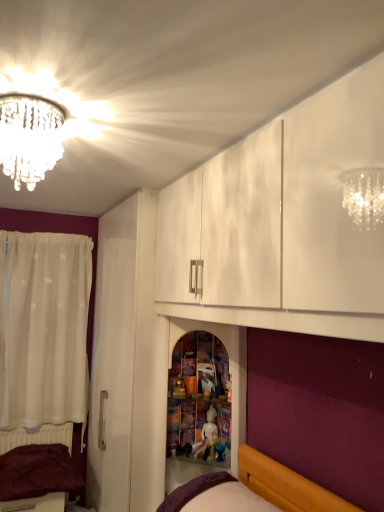
Question: Is white glossy statue at center surrounding purple fabric bed at lower center, which is the 2th bed from bottom to top?

Choices:
 (A) no
 (B) yes

Answer: (A)

Question: From the image's perspective, is white glossy statue at center located beneath purple fabric bed at lower center, which appears as the 1th bed when viewed from the right?

Choices:
 (A) yes
 (B) no

Answer: (B)

Question: Does white glossy statue at center have a lesser height compared to purple fabric bed at lower center, which ranks as the 2th bed in back-to-front order?

Choices:
 (A) no
 (B) yes

Answer: (A)

Question: Can you confirm if white glossy statue at center is positioned to the right of purple fabric bed at lower center, which is the 2th bed from bottom to top?

Choices:
 (A) yes
 (B) no

Answer: (B)

Question: From a real-world perspective, is white glossy statue at center below purple fabric bed at lower center, the 2th bed viewed from the left?

Choices:
 (A) yes
 (B) no

Answer: (B)

Question: Can you confirm if white glossy statue at center is taller than purple fabric bed at lower center, which ranks as the first bed in top-to-bottom order?

Choices:
 (A) no
 (B) yes

Answer: (B)

Question: Is white glossy statue at center next to purple fabric bed at lower left, positioned as the first bed in back-to-front order?

Choices:
 (A) yes
 (B) no

Answer: (B)

Question: From the image's perspective, is white glossy statue at center over purple fabric bed at lower left, positioned as the first bed in back-to-front order?

Choices:
 (A) no
 (B) yes

Answer: (B)

Question: Does white glossy statue at center lie in front of purple fabric bed at lower left, which is the second bed from front to back?

Choices:
 (A) yes
 (B) no

Answer: (A)

Question: Is white glossy statue at center to the left of purple fabric bed at lower left, the second bed positioned from the right, from the viewer's perspective?

Choices:
 (A) no
 (B) yes

Answer: (A)

Question: Is white glossy statue at center behind purple fabric bed at lower left, the first bed in the bottom-to-top sequence?

Choices:
 (A) no
 (B) yes

Answer: (A)

Question: Is white glossy statue at center oriented away from purple fabric bed at lower left, placed as the first bed when sorted from left to right?

Choices:
 (A) yes
 (B) no

Answer: (B)

Question: From the image's perspective, is purple fabric bed at lower left, placed as the first bed when sorted from left to right, above wooden shelf at center?

Choices:
 (A) no
 (B) yes

Answer: (A)